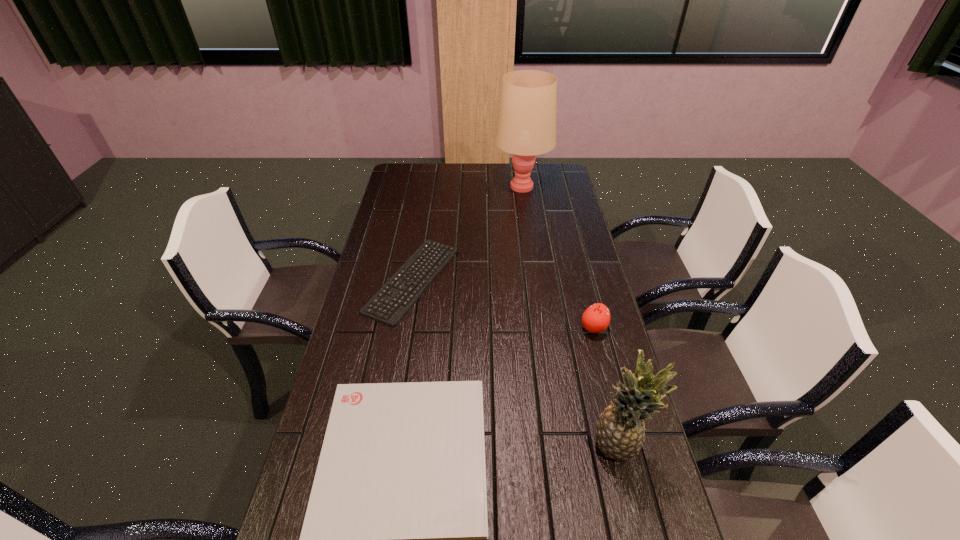
Where is `free space between the computer keyboard and the apple`? free space between the computer keyboard and the apple is located at coordinates (503, 304).

The image size is (960, 540). Find the location of `vacant space that's between the computer keyboard and the pineapple`. vacant space that's between the computer keyboard and the pineapple is located at coordinates (516, 363).

Where is `free point between the computer keyboard and the third tallest object`? This screenshot has height=540, width=960. free point between the computer keyboard and the third tallest object is located at coordinates (503, 304).

I want to click on object identified as the second closest to the tallest object, so click(x=596, y=318).

Where is `the third closest object to the pineapple`? the third closest object to the pineapple is located at coordinates (393, 295).

You are a GUI agent. You are given a task and a screenshot of the screen. Output one action in this format:
    pyautogui.click(x=<x>, y=<y>)
    Task: Click on the free spot that satisfies the following two spatial constraints: 1. on the back side of the fourth shortest object; 2. on the left side of the apple
    
    Given the screenshot: What is the action you would take?
    pyautogui.click(x=589, y=328)

The image size is (960, 540). I want to click on vacant space that satisfies the following two spatial constraints: 1. on the front side of the tallest object; 2. on the left side of the apple, so click(x=541, y=328).